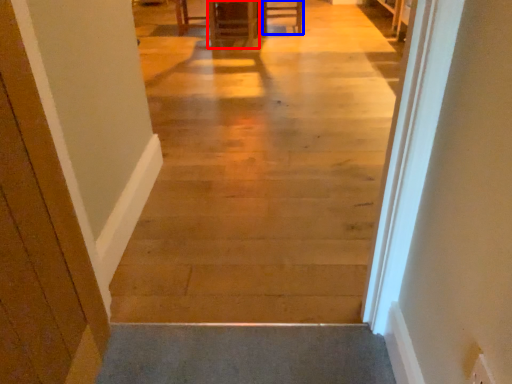
Question: Which object appears farthest to the camera in this image, furniture (highlighted by a red box) or furniture (highlighted by a blue box)?

Choices:
 (A) furniture
 (B) furniture

Answer: (B)